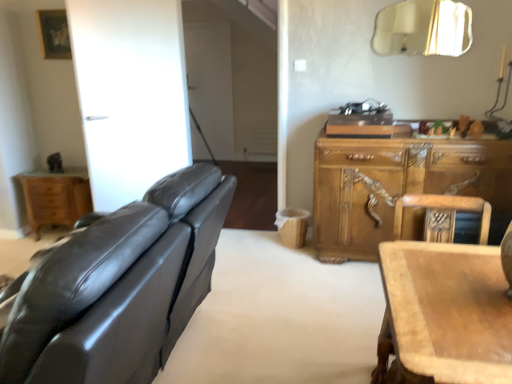
Question: Does matte black leather couch at left come in front of gold metallic mirror at upper right?

Choices:
 (A) no
 (B) yes

Answer: (B)

Question: Can we say matte black leather couch at left lies outside gold metallic mirror at upper right?

Choices:
 (A) yes
 (B) no

Answer: (A)

Question: From the image's perspective, is matte black leather couch at left on gold metallic mirror at upper right?

Choices:
 (A) yes
 (B) no

Answer: (B)

Question: Would you say matte black leather couch at left is a long distance from gold metallic mirror at upper right?

Choices:
 (A) no
 (B) yes

Answer: (B)

Question: Is matte black leather couch at left positioned behind gold metallic mirror at upper right?

Choices:
 (A) yes
 (B) no

Answer: (B)

Question: Considering the positions of wooden chair at right and light brown wood nightstand at left in the image, is wooden chair at right bigger or smaller than light brown wood nightstand at left?

Choices:
 (A) big
 (B) small

Answer: (A)

Question: Is point (472, 206) closer or farther from the camera than point (35, 203)?

Choices:
 (A) farther
 (B) closer

Answer: (B)

Question: From the image's perspective, relative to light brown wood nightstand at left, is wooden chair at right above or below?

Choices:
 (A) below
 (B) above

Answer: (A)

Question: Is wooden chair at right wider or thinner than light brown wood nightstand at left?

Choices:
 (A) thin
 (B) wide

Answer: (B)

Question: From their relative heights in the image, would you say light brown wood nightstand at left is taller or shorter than gold metallic mirror at upper right?

Choices:
 (A) tall
 (B) short

Answer: (A)

Question: Is light brown wood nightstand at left situated inside gold metallic mirror at upper right or outside?

Choices:
 (A) inside
 (B) outside

Answer: (B)

Question: From the image's perspective, is light brown wood nightstand at left above or below gold metallic mirror at upper right?

Choices:
 (A) above
 (B) below

Answer: (B)

Question: In terms of width, does light brown wood nightstand at left look wider or thinner when compared to gold metallic mirror at upper right?

Choices:
 (A) wide
 (B) thin

Answer: (A)

Question: From a real-world perspective, relative to gold metallic mirror at upper right, is wooden carved cabinet at right vertically above or below?

Choices:
 (A) below
 (B) above

Answer: (A)

Question: From the image's perspective, is wooden carved cabinet at right located above or below gold metallic mirror at upper right?

Choices:
 (A) above
 (B) below

Answer: (B)